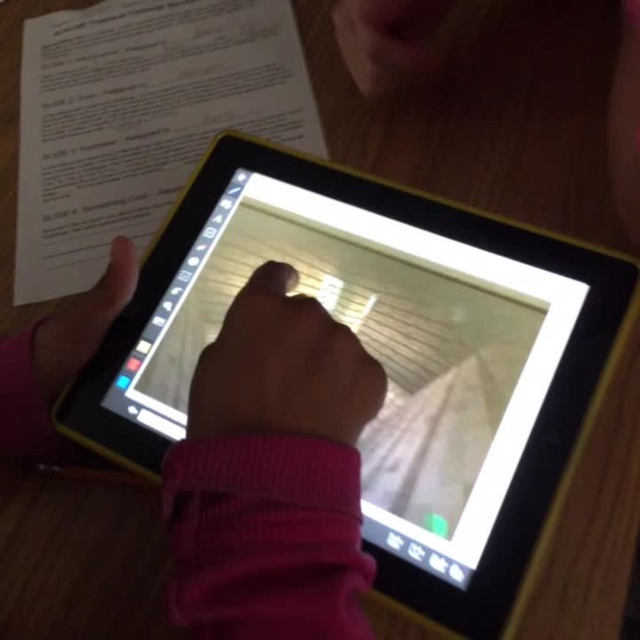
Based on the photo, you are a digital artist trying to reach the black plastic tablet at center to adjust the drawing. However, your matte black hand at lower left is blocking it. Can you move your hand to access the tablet without lifting it off the screen?

The black plastic tablet at center is below the matte black hand at lower left, so you can move your hand upwards to access the tablet without lifting it off the screen.

You are a robotic arm trying to reach the smooth skin hand at center. The robotic arm has a maximum reach of 5 inches. Can you reach it from where the matte black hand at lower left is located?

The smooth skin hand at center and matte black hand at lower left are 5.33 inches apart. Since the robotic arm can only reach 5 inches, it cannot reach the smooth skin hand at center from the matte black hand at lower left.